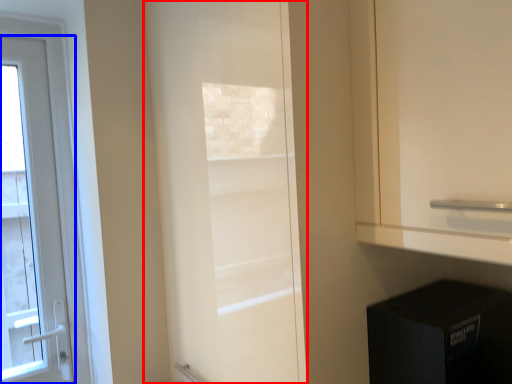
Question: Which object appears farthest to the camera in this image, door (highlighted by a red box) or door (highlighted by a blue box)?

Choices:
 (A) door
 (B) door

Answer: (B)